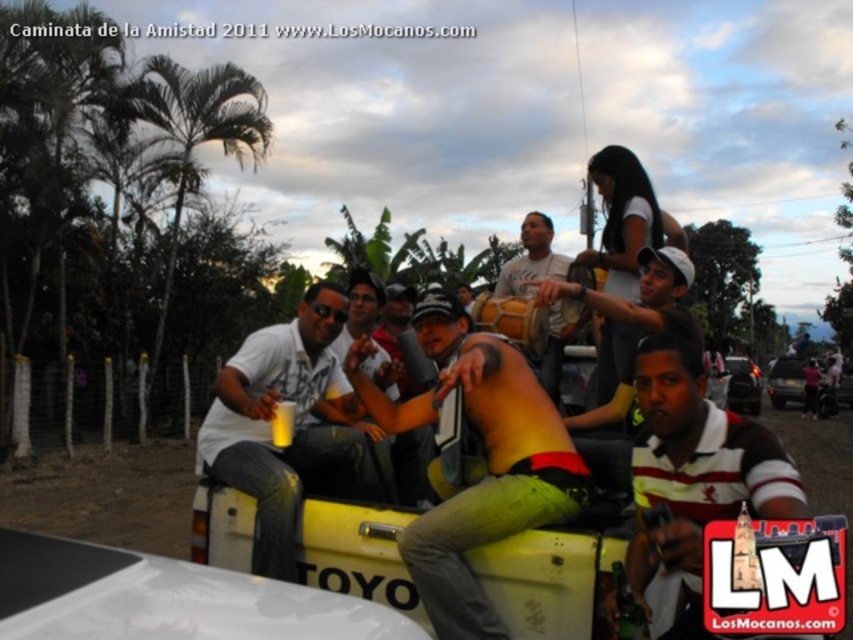
Question: Can you confirm if white matte truck bed at lower left is positioned to the left of matte yellow drum at center?

Choices:
 (A) no
 (B) yes

Answer: (B)

Question: Which point is farther to the camera?

Choices:
 (A) matte white shirt at center
 (B) yellow matte truck at center
 (C) black matte car at center

Answer: (C)

Question: Does green leafy palm tree at upper left appear on the right side of matte white shirt at center?

Choices:
 (A) yes
 (B) no

Answer: (B)

Question: In this image, where is white striped polo shirt at center located relative to matte yellow drum at center?

Choices:
 (A) left
 (B) right

Answer: (B)

Question: Which point is closer to the camera?

Choices:
 (A) matte white shirt at center
 (B) yellow matte truck at center
 (C) white matte shirt at center

Answer: (B)

Question: Which point appears farthest from the camera in this image?

Choices:
 (A) (527, 216)
 (B) (703, 410)
 (C) (688, 285)

Answer: (A)